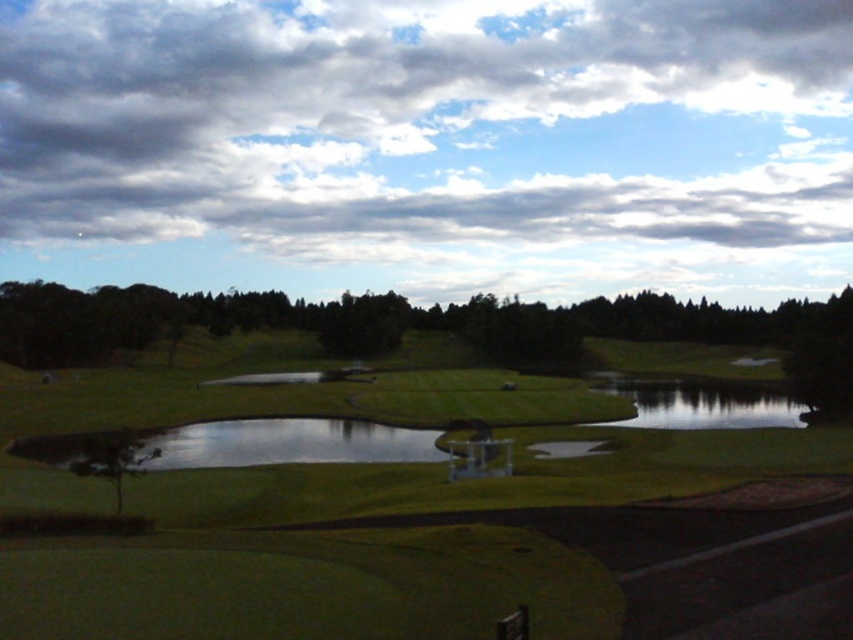
Is green grassy golf course at center positioned before green reflective water at center?

Yes, it is.

Between point (334, 598) and point (650, 396), which one is positioned in front?

Point (334, 598)

Image resolution: width=853 pixels, height=640 pixels. What do you see at coordinates (450, 550) in the screenshot? I see `green grassy golf course at center` at bounding box center [450, 550].

The width and height of the screenshot is (853, 640). In order to click on green grassy golf course at center in this screenshot , I will do `click(450, 550)`.

Does green grassy golf course at center appear on the right side of green leafy tree at lower left?

Yes, green grassy golf course at center is to the right of green leafy tree at lower left.

Who is higher up, green grassy golf course at center or green leafy tree at lower left?

green leafy tree at lower left is above.

Who is more forward, (x=225, y=561) or (x=68, y=465)?

Point (x=225, y=561)

Identify the location of green grassy golf course at center. The height and width of the screenshot is (640, 853). click(x=450, y=550).

Describe the element at coordinates (701, 403) in the screenshot. This screenshot has height=640, width=853. I see `green reflective water at center` at that location.

Does green reflective water at center have a smaller size compared to green leafy tree at lower left?

No, green reflective water at center is not smaller than green leafy tree at lower left.

Between point (598, 387) and point (103, 460), which one is positioned behind?

Positioned behind is point (598, 387).

The width and height of the screenshot is (853, 640). Find the location of `green reflective water at center`. green reflective water at center is located at coordinates (701, 403).